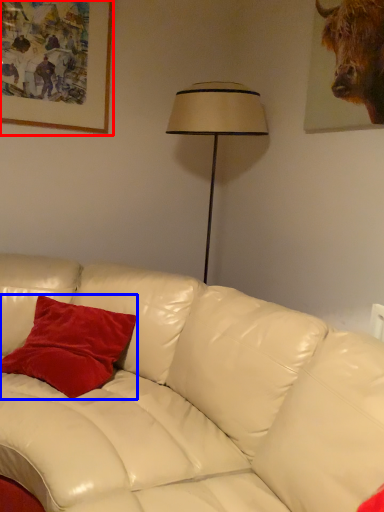
Question: Which object is further to the camera taking this photo, picture frame (highlighted by a red box) or pillow (highlighted by a blue box)?

Choices:
 (A) picture frame
 (B) pillow

Answer: (A)